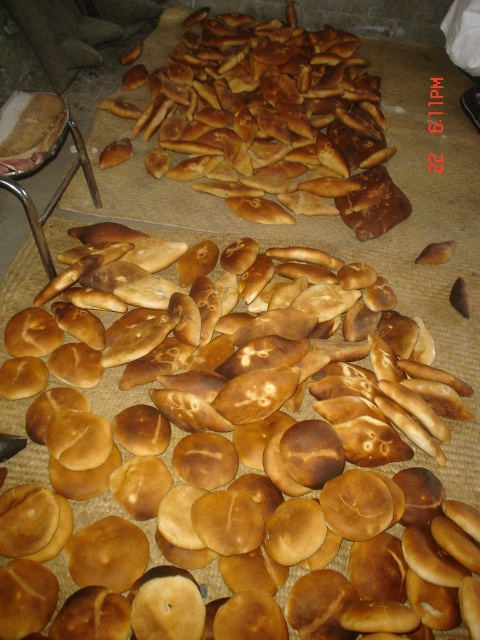
Is golden brown crusty bread at center wider than golden brown flatbread at upper center?

Yes, golden brown crusty bread at center is wider than golden brown flatbread at upper center.

Identify the location of golden brown crusty bread at center. (233, 467).

Locate an element on the screen. golden brown crusty bread at center is located at coordinates (233, 467).